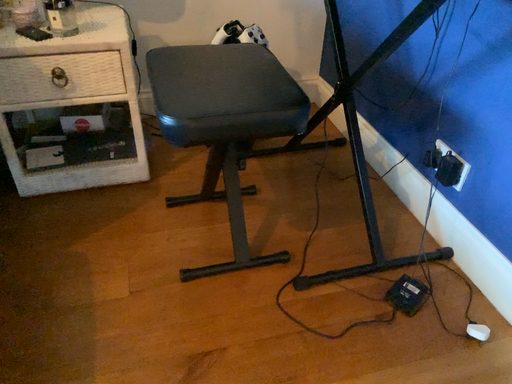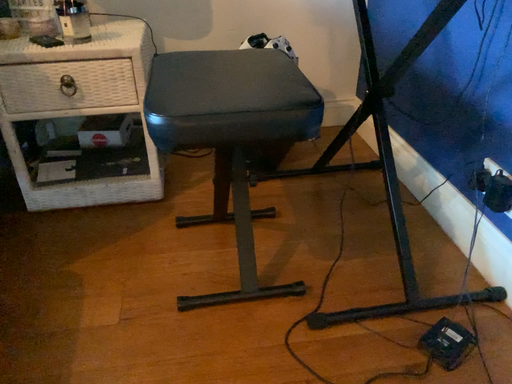
Question: Which way did the camera rotate in the video?

Choices:
 (A) rotated left
 (B) rotated right

Answer: (A)